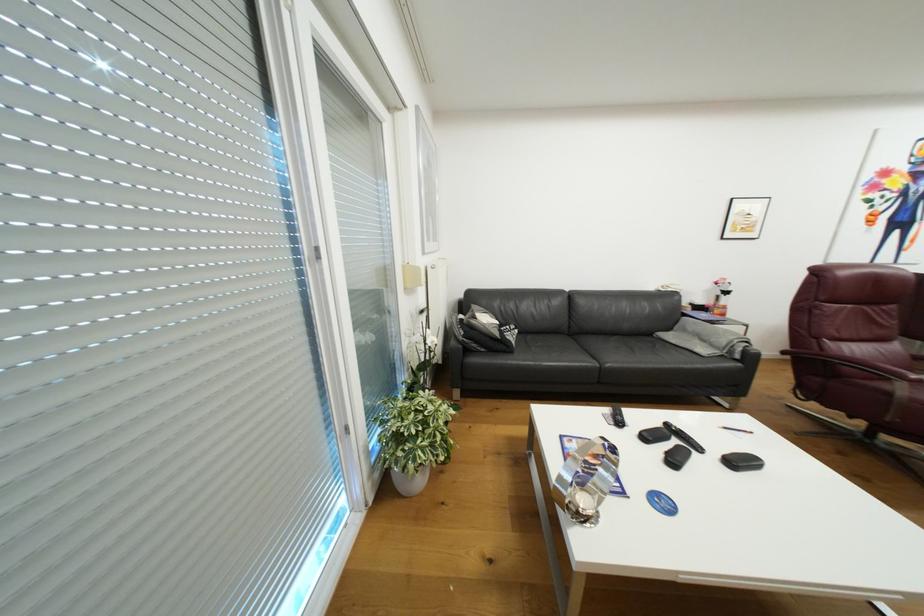
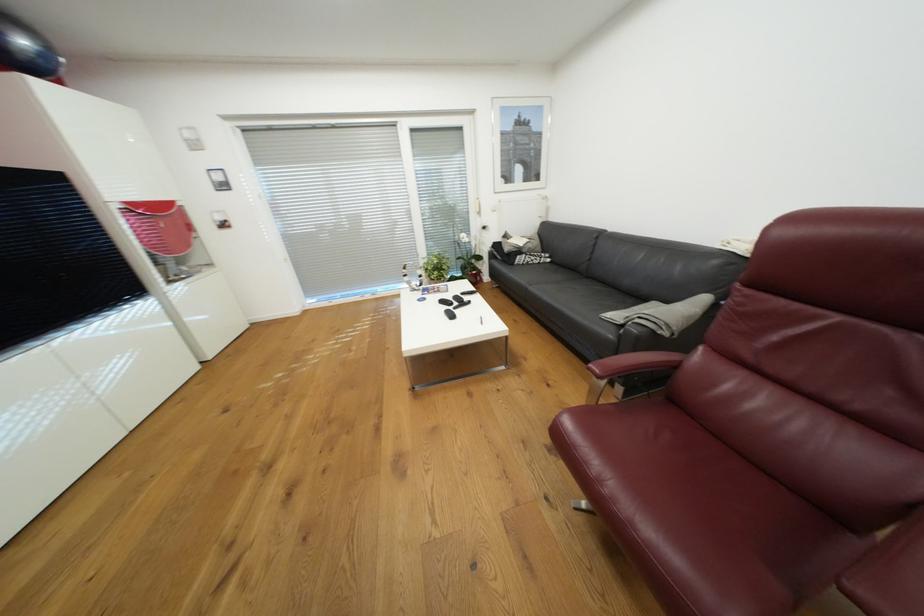
Find the pixel in the second image that matches the point at 507,331 in the first image.

(526, 252)